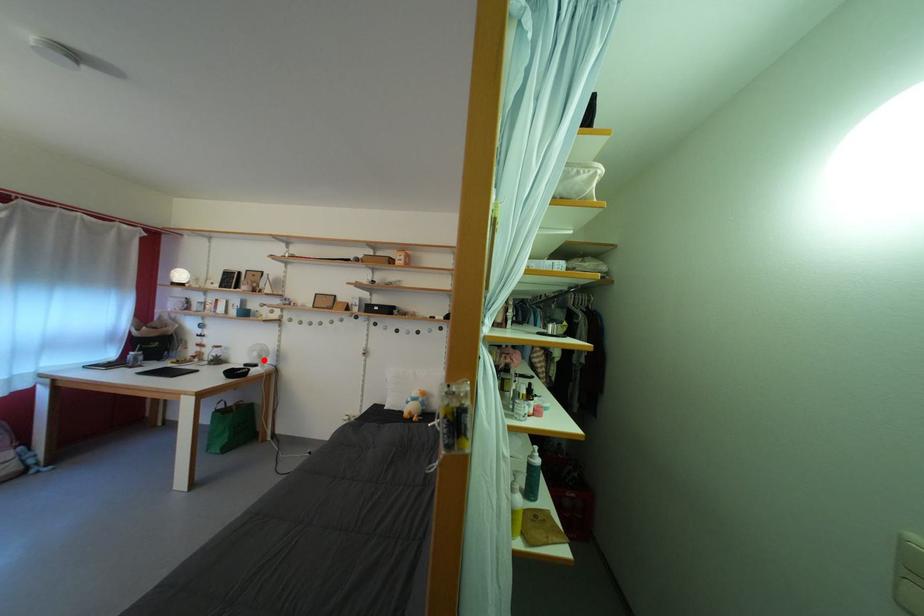
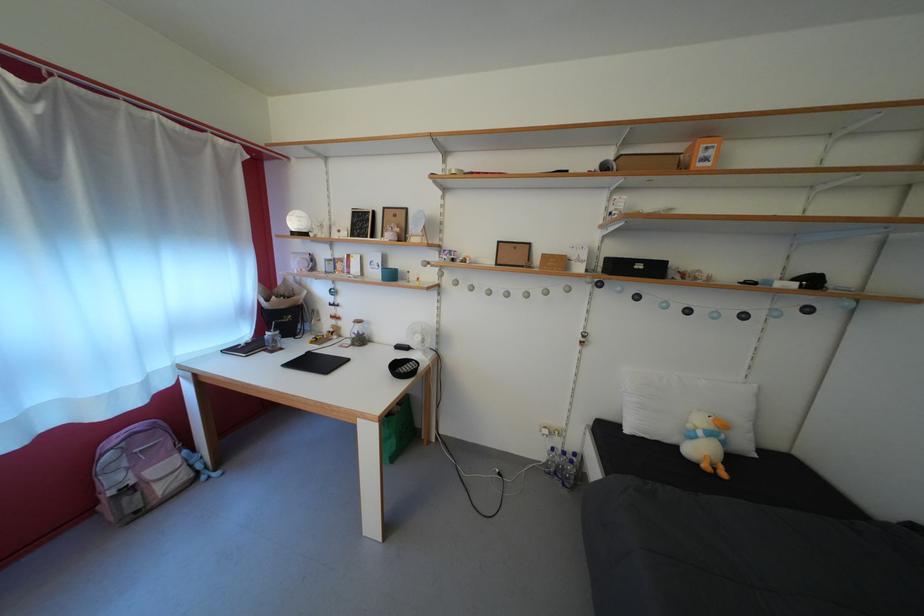
Where in the second image is the point corresponding to the highlighted location from the first image?

(427, 344)